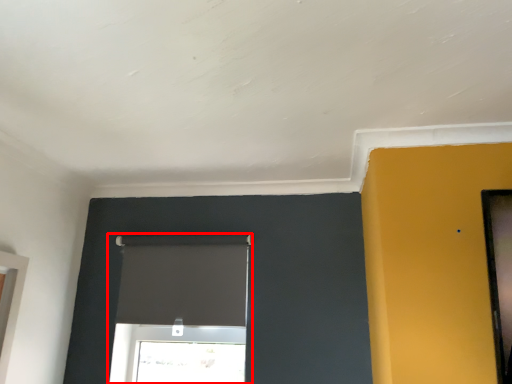
Question: Considering the relative positions of window (annotated by the red box) and window in the image provided, where is window (annotated by the red box) located with respect to the staircase?

Choices:
 (A) left
 (B) right

Answer: (B)